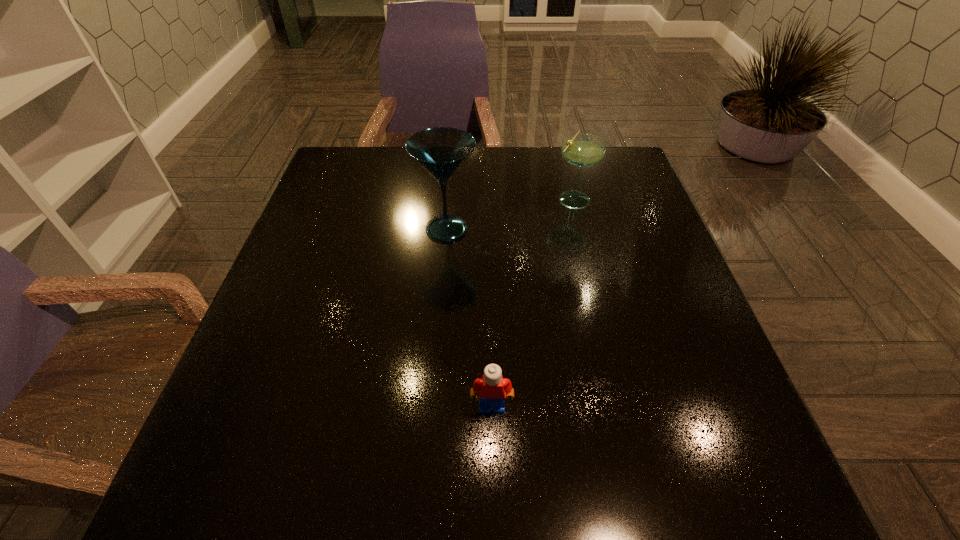
The width and height of the screenshot is (960, 540). In order to click on object that is positioned at the right edge in this screenshot , I will do `click(583, 150)`.

Identify the location of object that is at the far right corner. The height and width of the screenshot is (540, 960). (583, 150).

Identify the location of vacant space at the far edge of the desktop. (475, 148).

What are the coordinates of `vacant space at the near edge` in the screenshot? It's located at (597, 488).

At what (x,y) coordinates should I click in order to perform the action: click on vacant space at the left edge. Please return your answer as a coordinate pair (x, y). Image resolution: width=960 pixels, height=540 pixels. Looking at the image, I should click on (301, 243).

Locate an element on the screen. vacant space at the right edge of the desktop is located at coordinates (623, 223).

At what (x,y) coordinates should I click in order to perform the action: click on free space at the near left corner of the desktop. Please return your answer as a coordinate pair (x, y). The image size is (960, 540). Looking at the image, I should click on (231, 494).

Locate an element on the screen. free space at the far right corner of the desktop is located at coordinates [610, 190].

Where is `free space that is in between the Lego and the right martini`? free space that is in between the Lego and the right martini is located at coordinates (533, 302).

This screenshot has height=540, width=960. I want to click on free space between the tallest object and the nearest object, so click(x=469, y=318).